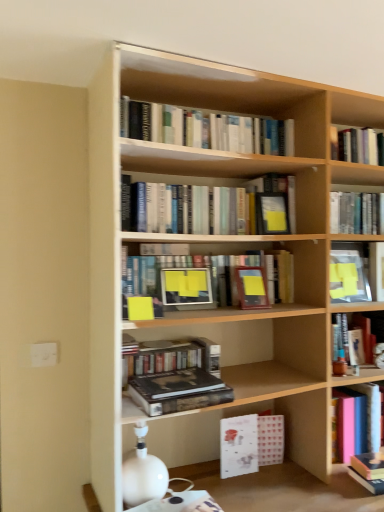
Question: Does hardcover book at right, which is the third book in bottom-to-top order, have a larger size compared to light wood bookcase at center?

Choices:
 (A) yes
 (B) no

Answer: (B)

Question: From the image's perspective, is hardcover book at right, which is the third book in bottom-to-top order, over light wood bookcase at center?

Choices:
 (A) no
 (B) yes

Answer: (A)

Question: Are hardcover book at right, which is the third book in bottom-to-top order, and light wood bookcase at center far apart?

Choices:
 (A) yes
 (B) no

Answer: (B)

Question: Is hardcover book at right, which is the third book in bottom-to-top order, placed right next to light wood bookcase at center?

Choices:
 (A) yes
 (B) no

Answer: (B)

Question: Is hardcover book at right, which is the third book in bottom-to-top order, thinner than light wood bookcase at center?

Choices:
 (A) yes
 (B) no

Answer: (A)

Question: Relative to matte wooden frame at center, the 5th book in the top-to-bottom sequence, is translucent plastic book at upper right, which is the 4th book in top-to-bottom order, in front or behind?

Choices:
 (A) front
 (B) behind

Answer: (B)

Question: From their relative heights in the image, would you say translucent plastic book at upper right, which is the 4th book in top-to-bottom order, is taller or shorter than matte wooden frame at center, the 5th book in the top-to-bottom sequence?

Choices:
 (A) short
 (B) tall

Answer: (B)

Question: Is translucent plastic book at upper right, which is the 4th book in top-to-bottom order, to the left or to the right of matte wooden frame at center, which appears as the fourth book when ordered from the bottom, in the image?

Choices:
 (A) right
 (B) left

Answer: (A)

Question: Considering the positions of point (362, 281) and point (200, 267), is point (362, 281) closer or farther from the camera than point (200, 267)?

Choices:
 (A) closer
 (B) farther

Answer: (B)

Question: In the image, is matte wooden frame at center, which appears as the fourth book when ordered from the bottom, on the left side or the right side of hardcover book at upper right, the 1th book viewed from the top?

Choices:
 (A) left
 (B) right

Answer: (A)

Question: Is matte wooden frame at center, the 5th book in the top-to-bottom sequence, bigger or smaller than hardcover book at upper right, arranged as the 8th book when ordered from the bottom?

Choices:
 (A) small
 (B) big

Answer: (B)

Question: From the image's perspective, is matte wooden frame at center, which appears as the fourth book when ordered from the bottom, positioned above or below hardcover book at upper right, arranged as the 8th book when ordered from the bottom?

Choices:
 (A) below
 (B) above

Answer: (A)

Question: Considering their positions, is matte wooden frame at center, the 5th book in the top-to-bottom sequence, located in front of or behind hardcover book at upper right, the 1th book viewed from the top?

Choices:
 (A) behind
 (B) front

Answer: (B)

Question: In the image, is hardcover book at upper right, the 1th book viewed from the top, positioned in front of or behind pink matte book at right, the 8th book in the top-to-bottom sequence?

Choices:
 (A) behind
 (B) front

Answer: (A)

Question: Is hardcover book at upper right, the 1th book viewed from the top, inside the boundaries of pink matte book at right, the 8th book in the top-to-bottom sequence, or outside?

Choices:
 (A) outside
 (B) inside

Answer: (A)